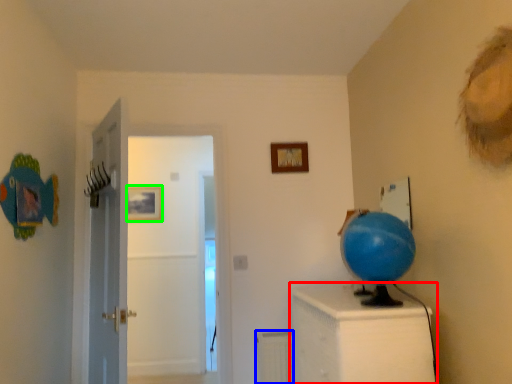
Question: Estimate the real-world distances between objects in this image. Which object is closer to furniture (highlighted by a red box), radiator (highlighted by a blue box) or picture frame (highlighted by a green box)?

Choices:
 (A) radiator
 (B) picture frame

Answer: (A)